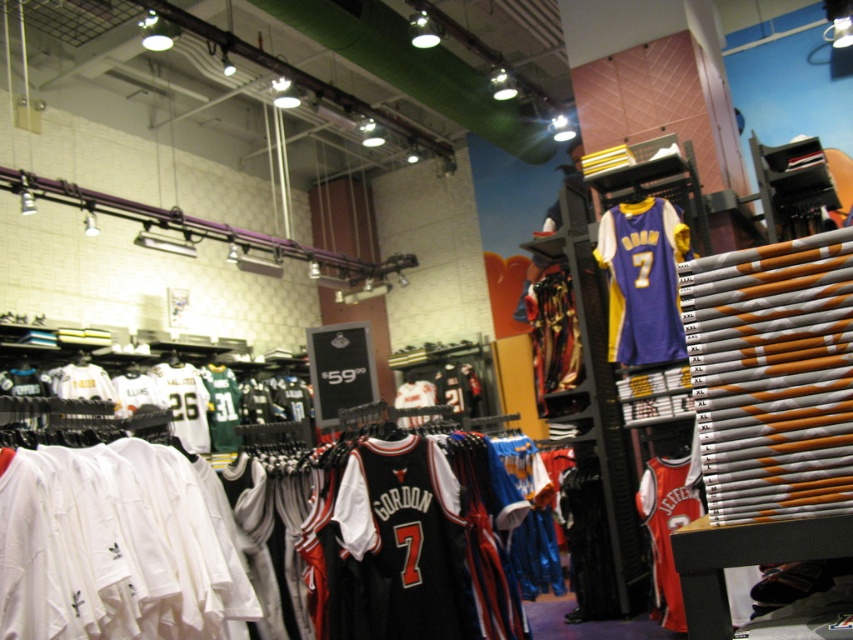
You are a customer in the sports apparel store and want to know if the black jersey at center and the red jersey at center are close enough to touch each other if you stand between them. Can you determine this?

The black jersey at center is 5.15 feet from the red jersey at center, so they are not close enough to touch each other when standing between them since the distance is greater than typical arm span.

You are a customer in the sports apparel store and want to choose between the black jersey at center and the purple jersey at center. Which one is narrower in width?

The black jersey at center is thinner than the purple jersey at center, so the black jersey at center is narrower in width.